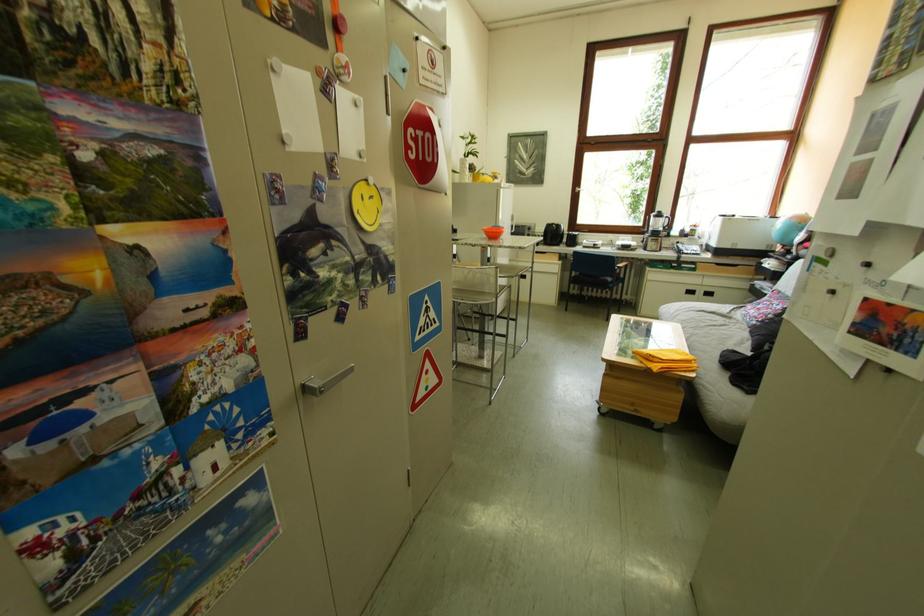
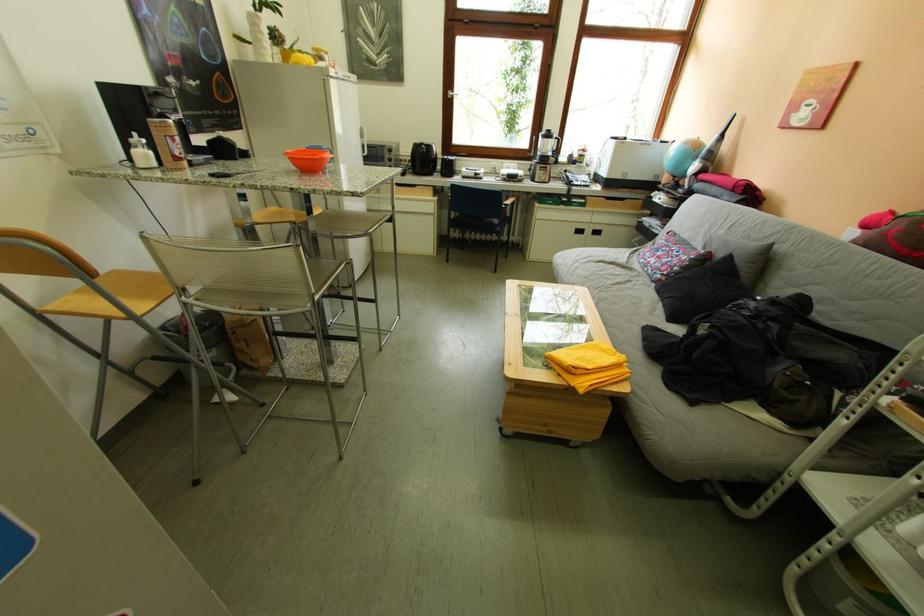
Find the pixel in the second image that matches point (666, 241) in the first image.

(554, 169)